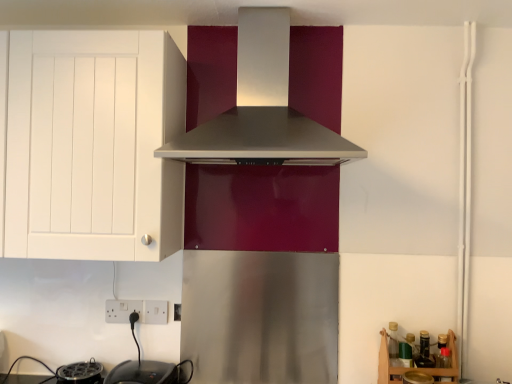
Question: Does white matte cabinet at left have a greater width compared to black plastic toaster at lower left, positioned as the second appliance in right-to-left order?

Choices:
 (A) no
 (B) yes

Answer: (B)

Question: Is white matte cabinet at left to the left of black plastic toaster at lower left, arranged as the 1th appliance when viewed from the left, from the viewer's perspective?

Choices:
 (A) yes
 (B) no

Answer: (A)

Question: Can you confirm if white matte cabinet at left is shorter than black plastic toaster at lower left, arranged as the 1th appliance when viewed from the left?

Choices:
 (A) no
 (B) yes

Answer: (A)

Question: Can you confirm if white matte cabinet at left is bigger than black plastic toaster at lower left, positioned as the second appliance in right-to-left order?

Choices:
 (A) yes
 (B) no

Answer: (A)

Question: Is white matte cabinet at left completely or partially outside of black plastic toaster at lower left, arranged as the 1th appliance when viewed from the left?

Choices:
 (A) yes
 (B) no

Answer: (A)

Question: Based on their sizes in the image, would you say white matte cabinet at left is bigger or smaller than black plastic toaster at lower left, positioned as the second appliance in right-to-left order?

Choices:
 (A) big
 (B) small

Answer: (A)

Question: In the image, is white matte cabinet at left on the left side or the right side of black plastic toaster at lower left, positioned as the second appliance in right-to-left order?

Choices:
 (A) right
 (B) left

Answer: (B)

Question: Is white matte cabinet at left spatially inside black plastic toaster at lower left, positioned as the second appliance in right-to-left order, or outside of it?

Choices:
 (A) inside
 (B) outside

Answer: (B)

Question: In terms of width, does white matte cabinet at left look wider or thinner when compared to black plastic toaster at lower left, arranged as the 1th appliance when viewed from the left?

Choices:
 (A) wide
 (B) thin

Answer: (A)

Question: From the image's perspective, is wooden at lower right above or below black glossy electric kettle at lower left, which is counted as the 1th appliance, starting from the right?

Choices:
 (A) below
 (B) above

Answer: (B)

Question: Is wooden at lower right inside the boundaries of black glossy electric kettle at lower left, placed as the 2th appliance when sorted from left to right, or outside?

Choices:
 (A) outside
 (B) inside

Answer: (A)

Question: Is wooden at lower right bigger or smaller than black glossy electric kettle at lower left, placed as the 2th appliance when sorted from left to right?

Choices:
 (A) small
 (B) big

Answer: (B)

Question: Is wooden at lower right to the left or to the right of black glossy electric kettle at lower left, placed as the 2th appliance when sorted from left to right, in the image?

Choices:
 (A) right
 (B) left

Answer: (A)

Question: Is satin silver range hood at center taller or shorter than wooden at lower right?

Choices:
 (A) tall
 (B) short

Answer: (A)

Question: Based on their sizes in the image, would you say satin silver range hood at center is bigger or smaller than wooden at lower right?

Choices:
 (A) big
 (B) small

Answer: (A)